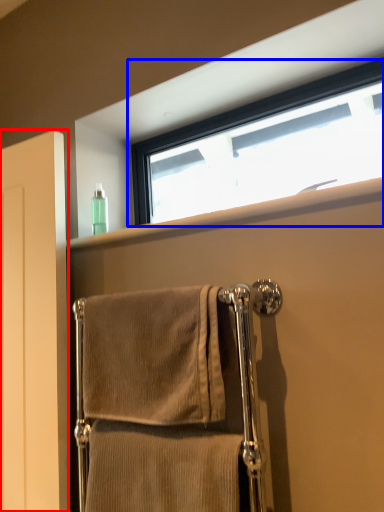
Question: Which object is further to the camera taking this photo, screen door (highlighted by a red box) or window (highlighted by a blue box)?

Choices:
 (A) screen door
 (B) window

Answer: (A)